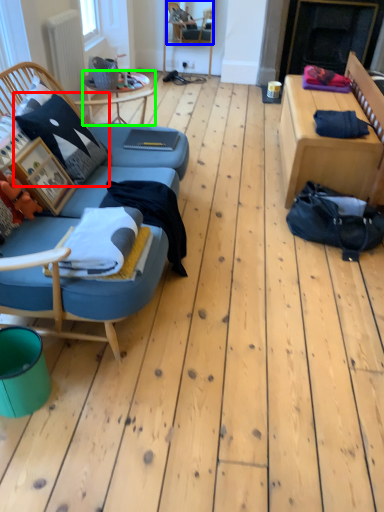
Question: Which is farther away from pillow (highlighted by a red box)? chair (highlighted by a blue box) or table (highlighted by a green box)?

Choices:
 (A) chair
 (B) table

Answer: (A)